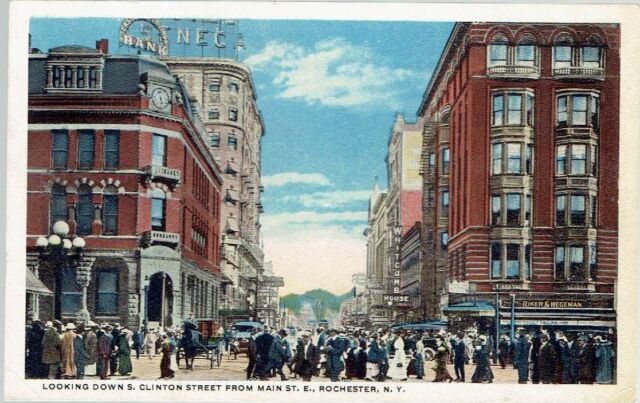
Image resolution: width=640 pixels, height=403 pixels. Identify the location of lights. click(x=41, y=239), click(x=52, y=239), click(x=59, y=227), click(x=67, y=241), click(x=81, y=242).